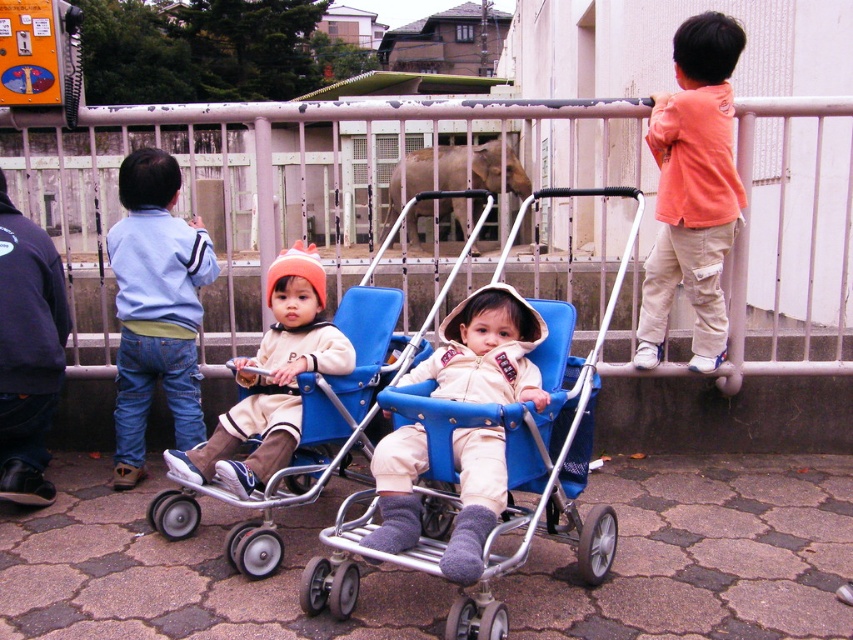
Question: Which object is closer to the camera taking this photo?

Choices:
 (A) metallic silver rail at upper center
 (B) beige soft fabric baby stroller at center
 (C) blue denim jeans at left
 (D) matte beige jacket at center

Answer: (B)

Question: Considering the real-world distances, which object is closest to the blue denim jeans at left?

Choices:
 (A) blue plastic baby carriage at center
 (B) matte beige jacket at center
 (C) beige soft fabric baby stroller at center
 (D) orange cotton shirt at upper right

Answer: (B)

Question: Can you confirm if beige soft fabric baby stroller at center is thinner than matte beige jacket at center?

Choices:
 (A) no
 (B) yes

Answer: (B)

Question: Does metallic silver rail at upper center appear under matte beige jacket at center?

Choices:
 (A) no
 (B) yes

Answer: (A)

Question: Which object is closer to the camera taking this photo?

Choices:
 (A) blue denim jeans at left
 (B) blue plastic baby carriage at center
 (C) matte beige jacket at center
 (D) orange cotton shirt at upper right

Answer: (B)

Question: Is metallic silver rail at upper center thinner than blue denim jeans at left?

Choices:
 (A) no
 (B) yes

Answer: (A)